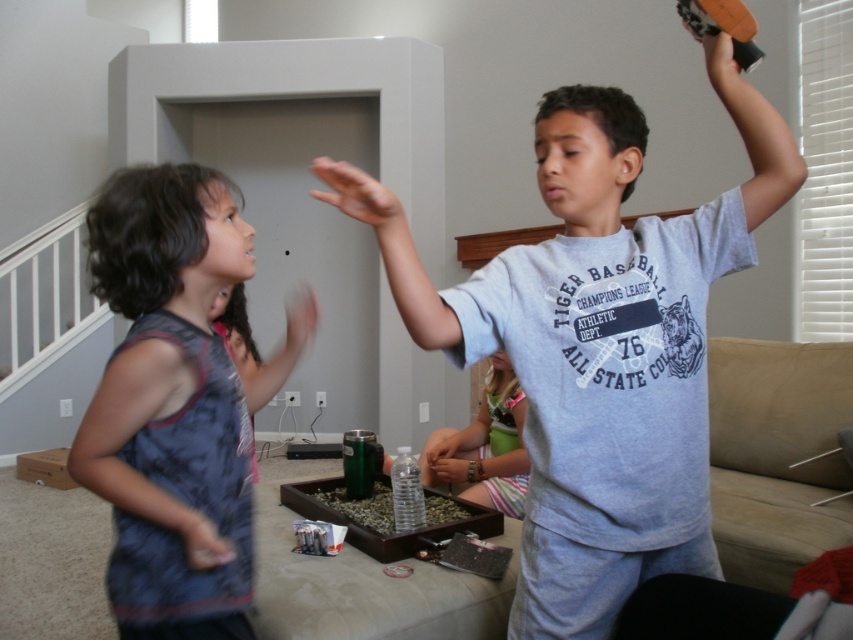
You are a photographer trying to capture the perfect shot of the children in the scene. You notice a point at coordinates (598,342). What object is located at this point?

The point at coordinates (598,342) marks the gray cotton shirt at center.

You are a photographer trying to capture a photo of the dark blue sleeveless shirt at left and the striped fabric pants at center. Based on their positions, which object should you focus on first to ensure both are in the frame?

The dark blue sleeveless shirt at left is much taller than the striped fabric pants at center, so you should focus on the taller object first to ensure both are in the frame.

You are a photographer setting up a photo shoot. You need to position a light source so that it illuminates both the gray cotton shirt at center and the dark blue sleeveless shirt at left. Given their height difference, where should you place the light source to ensure both are evenly lit?

The gray cotton shirt at center is much taller than the dark blue sleeveless shirt at left. To ensure both are evenly lit, the light source should be placed higher above the gray cotton shirt at center so that the light can reach both the taller and shorter objects effectively.